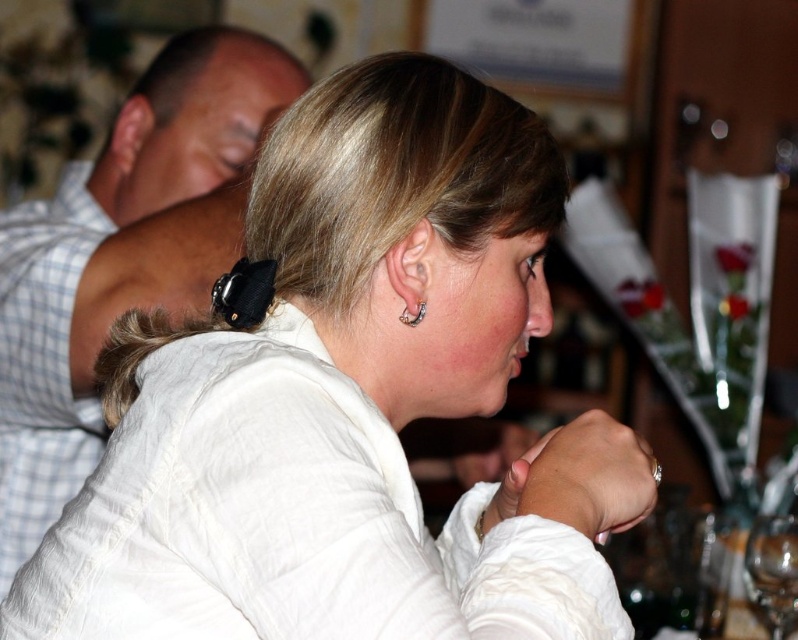
You are at a social gathering and want to get a drink from the table where the woman is sitting. There is a transparent glass at lower right at point (773, 568). Can you reach it without moving the sleeping man leaning forward on the table?

The transparent glass at lower right at point (773, 568) is located at the lower right of the table, so you can reach it without disturbing the sleeping man who is leaning forward on the table.

You are a server at a restaurant and need to carry a tray of drinks that is 1.2 meters wide. You see the white checkered fabric at upper left and the transparent glass at lower right. Can you safely move the tray between them without hitting either?

The distance between the white checkered fabric at upper left and transparent glass at lower right is 1.10 meters, which is narrower than the tray width of 1.2 meters. Therefore, the tray cannot be safely moved between them without risking collision.

You are a photographer at the event and want to capture a closeup of the transparent glass at lower right and the silver metallic earring at ear. Which object should you zoom in on to ensure both are in focus?

The transparent glass at lower right is much taller as silver metallic earring at ear, so you should zoom in on the transparent glass at lower right to ensure both are in focus because it is larger and easier to capture details.